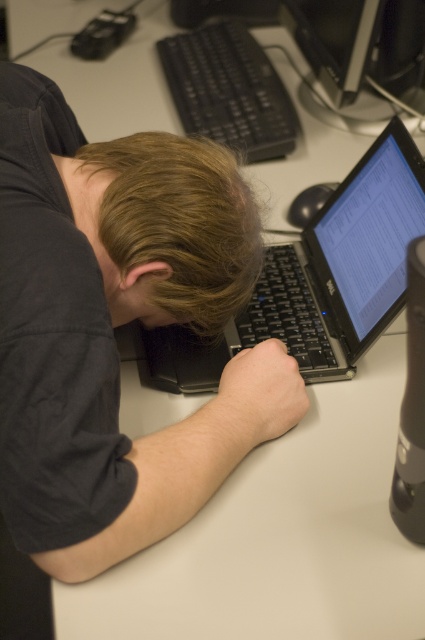
You are standing in front of the desk and want to place a new keyboard. The existing keyboard is located at point (x=317, y=280). Where should you place the new keyboard to avoid overlapping with the existing one?

The existing keyboard is at point (x=317, y=280), so place the new keyboard elsewhere on the desk to avoid overlapping.

You are organizing a desk and need to ensure that the brown matte hair at center and the black glossy monitor at upper center are spaced appropriately. Which object is narrower so that you can adjust the spacing accordingly?

The brown matte hair at center is narrower than the black glossy monitor at upper center, so you should adjust the spacing to accommodate the narrower width of the brown matte hair at center.

You are a coworker entering the office and see the brown matte hair at center and the black glossy monitor at upper center on the desk. Which object is positioned closer to you as you approach the desk?

The brown matte hair at center is closer to the viewer than the black glossy monitor at upper center, so the brown matte hair at center is positioned closer to you.